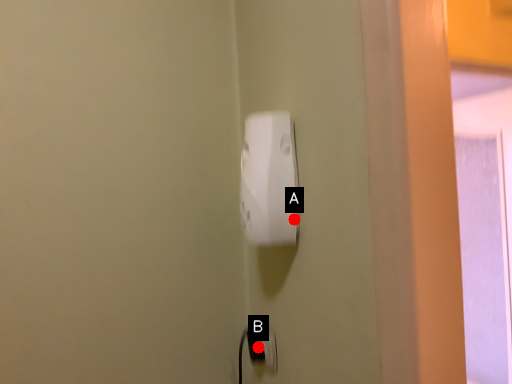
Question: Two points are circled on the image, labeled by A and B beside each circle. Among these points, which one is farthest from the camera?

Choices:
 (A) A is further
 (B) B is further

Answer: (B)